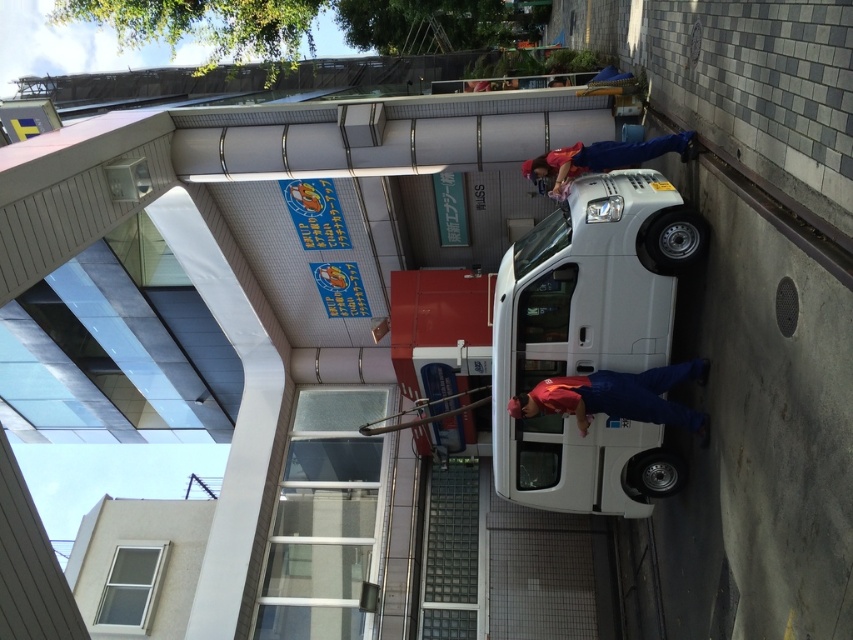
Which is more to the right, red matte uniform at center or matte red shirt at upper right?

From the viewer's perspective, matte red shirt at upper right appears more on the right side.

Can you confirm if red matte uniform at center is wider than matte red shirt at upper right?

Indeed, red matte uniform at center has a greater width compared to matte red shirt at upper right.

Does point (544, 385) come farther from viewer compared to point (624, 164)?

No, it is in front of (624, 164).

Find the location of a particular element. The image size is (853, 640). red matte uniform at center is located at coordinates (618, 396).

Who is higher up, white glossy van at center or red matte uniform at center?

Positioned higher is white glossy van at center.

Does white glossy van at center appear over red matte uniform at center?

Indeed, white glossy van at center is positioned over red matte uniform at center.

Locate an element on the screen. The image size is (853, 640). white glossy van at center is located at coordinates (589, 340).

Where is `white glossy van at center`? Image resolution: width=853 pixels, height=640 pixels. white glossy van at center is located at coordinates (589, 340).

Is white glossy van at center positioned at the back of matte red shirt at upper right?

No, it is in front of matte red shirt at upper right.

What do you see at coordinates (589, 340) in the screenshot?
I see `white glossy van at center` at bounding box center [589, 340].

Identify the location of white glossy van at center. (589, 340).